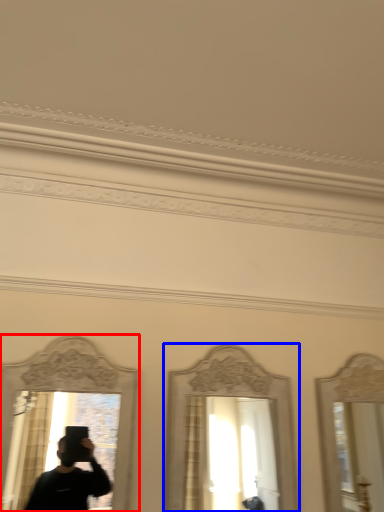
Question: Among these objects, which one is farthest to the camera, mirror (highlighted by a red box) or mirror (highlighted by a blue box)?

Choices:
 (A) mirror
 (B) mirror

Answer: (B)